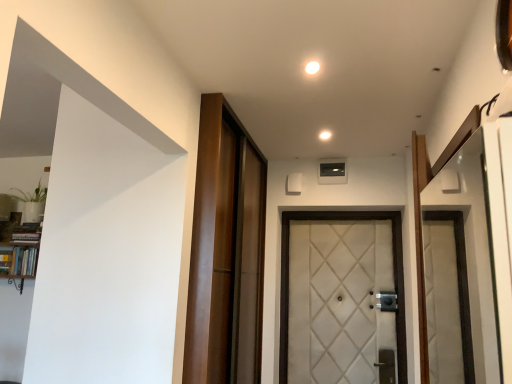
Question: From the image's perspective, is white quilted fabric door at center located beneath white glossy light at center, marked as the 2th light in a top-to-bottom arrangement?

Choices:
 (A) yes
 (B) no

Answer: (A)

Question: From a real-world perspective, does white quilted fabric door at center sit lower than white glossy light at center, acting as the 2th light starting from the front?

Choices:
 (A) no
 (B) yes

Answer: (B)

Question: Does white quilted fabric door at center have a greater width compared to white glossy light at center, the first light when ordered from right to left?

Choices:
 (A) no
 (B) yes

Answer: (B)

Question: Is white glossy light at center, marked as the 2th light in a top-to-bottom arrangement, inside white quilted fabric door at center?

Choices:
 (A) yes
 (B) no

Answer: (B)

Question: Is white quilted fabric door at center not inside white glossy light at center, positioned as the 1th light in bottom-to-top order?

Choices:
 (A) yes
 (B) no

Answer: (A)

Question: From the image's perspective, is white quilted fabric door at center located above white glossy light at center, acting as the 2th light starting from the front?

Choices:
 (A) yes
 (B) no

Answer: (B)

Question: From the image's perspective, is white glossy light at center, which ranks as the second light in left-to-right order, below wooden bookshelf at left?

Choices:
 (A) no
 (B) yes

Answer: (A)

Question: Considering the relative sizes of white glossy light at center, placed as the 1th light when sorted from back to front, and wooden bookshelf at left in the image provided, is white glossy light at center, placed as the 1th light when sorted from back to front, bigger than wooden bookshelf at left?

Choices:
 (A) yes
 (B) no

Answer: (B)

Question: Considering the relative sizes of white glossy light at center, positioned as the 1th light in bottom-to-top order, and wooden bookshelf at left in the image provided, is white glossy light at center, positioned as the 1th light in bottom-to-top order, wider than wooden bookshelf at left?

Choices:
 (A) no
 (B) yes

Answer: (A)

Question: From a real-world perspective, is white glossy light at center, placed as the 1th light when sorted from back to front, beneath wooden bookshelf at left?

Choices:
 (A) yes
 (B) no

Answer: (B)

Question: From the image's perspective, is white glossy light at center, acting as the 2th light starting from the front, on top of wooden bookshelf at left?

Choices:
 (A) no
 (B) yes

Answer: (B)

Question: Is white glossy light at center, positioned as the 1th light in bottom-to-top order, thinner than wooden bookshelf at left?

Choices:
 (A) yes
 (B) no

Answer: (A)

Question: Is wooden barn door at center positioned far away from white glossy light at upper center, the 2th light ordered from the bottom?

Choices:
 (A) no
 (B) yes

Answer: (B)